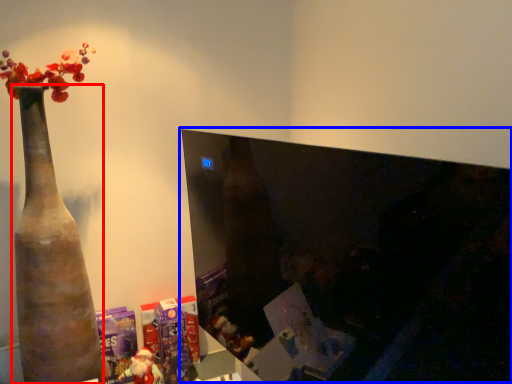
Question: Among these objects, which one is farthest to the camera, vase (highlighted by a red box) or computer monitor (highlighted by a blue box)?

Choices:
 (A) vase
 (B) computer monitor

Answer: (A)